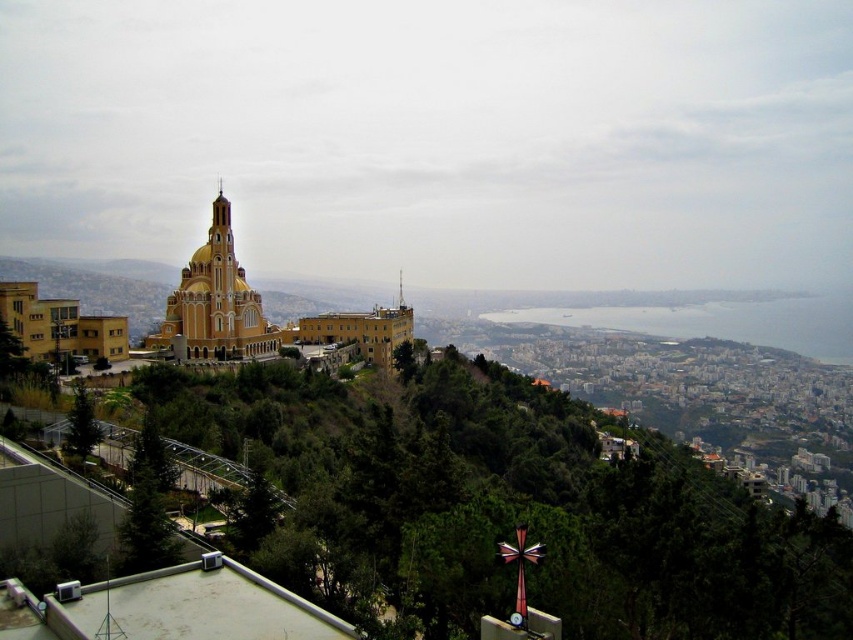
You are standing at the point marked as point (215, 301) in the cityscape image. What structure are you currently positioned at?

You are at the gold metallic church at center located at point (215, 301).

You are standing at the vantage point looking at the cityscape. There are two points marked in the image. Which of the two points, point (245, 332) or point (90, 358), is closer to your current position?

Point (245, 332) is further to the camera than point (90, 358). Therefore, point (90, 358) is closer to your current position.